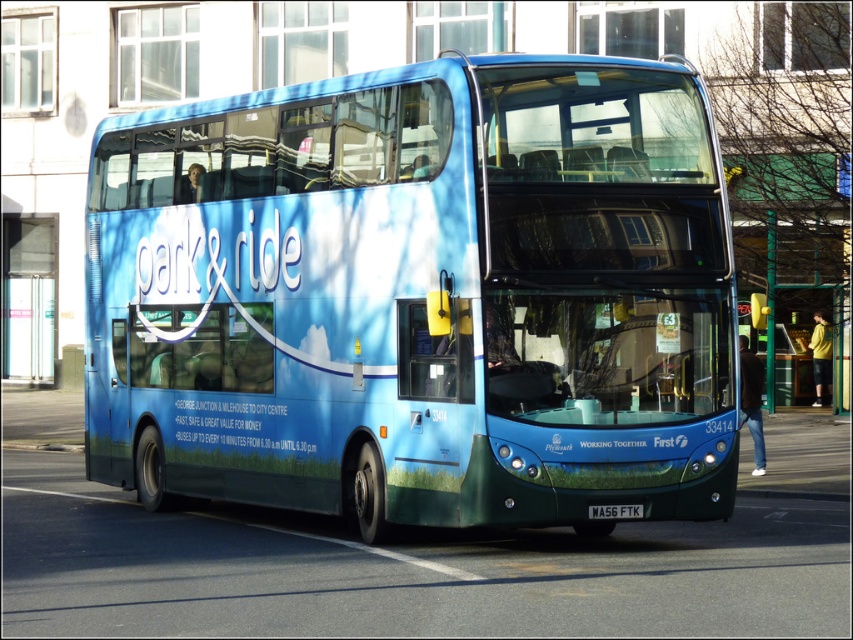
Between blue metallic bus at center and black plastic license plate at center, which one appears on the left side from the viewer's perspective?

blue metallic bus at center

From the picture: Who is higher up, blue metallic bus at center or black plastic license plate at center?

blue metallic bus at center is above.

Is point (711, 488) less distant than point (628, 508)?

No, (711, 488) is behind (628, 508).

I want to click on blue metallic bus at center, so click(421, 296).